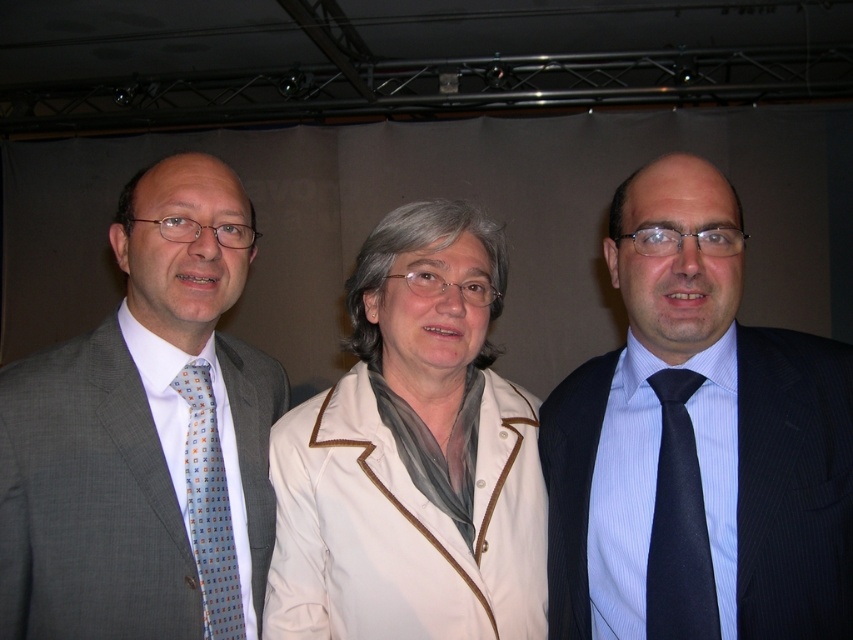
Is dark blue pinstripe suit at right wider than gray textured suit at left?

Yes.

Is dark blue pinstripe suit at right behind gray textured suit at left?

No.

Between point (741, 564) and point (45, 381), which one is positioned in front?

Point (741, 564) is more forward.

You are a GUI agent. You are given a task and a screenshot of the screen. Output one action in this format:
    pyautogui.click(x=<x>, y=<y>)
    Task: Click on the dark blue pinstripe suit at right
    
    Given the screenshot: What is the action you would take?
    pyautogui.click(x=697, y=444)

Who is lower down, gray textured suit at left or light blue printed tie at left?

light blue printed tie at left

In the scene shown: Who is shorter, gray textured suit at left or light blue printed tie at left?

With less height is light blue printed tie at left.

The width and height of the screenshot is (853, 640). Describe the element at coordinates (144, 436) in the screenshot. I see `gray textured suit at left` at that location.

At what (x,y) coordinates should I click in order to perform the action: click on gray textured suit at left. Please return your answer as a coordinate pair (x, y). The width and height of the screenshot is (853, 640). Looking at the image, I should click on (144, 436).

Looking at this image, is gray textured suit at left further to the viewer compared to white fabric coat at center?

Yes.

What do you see at coordinates (144, 436) in the screenshot? The width and height of the screenshot is (853, 640). I see `gray textured suit at left` at bounding box center [144, 436].

Where is `gray textured suit at left`? The width and height of the screenshot is (853, 640). gray textured suit at left is located at coordinates (144, 436).